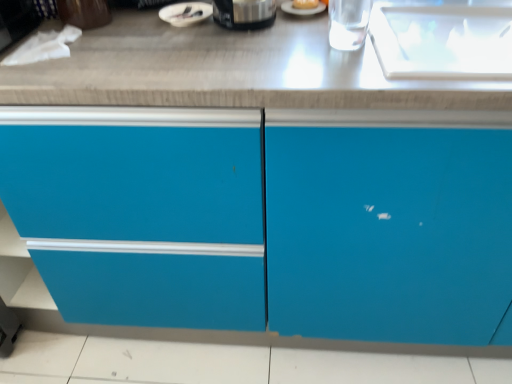
You are a GUI agent. You are given a task and a screenshot of the screen. Output one action in this format:
    pyautogui.click(x=<x>, y=<y>)
    Task: Click on the blank space to the left of satin black coffee maker at upper center, the 1th appliance when ordered from right to left
    
    Given the screenshot: What is the action you would take?
    pyautogui.click(x=155, y=37)